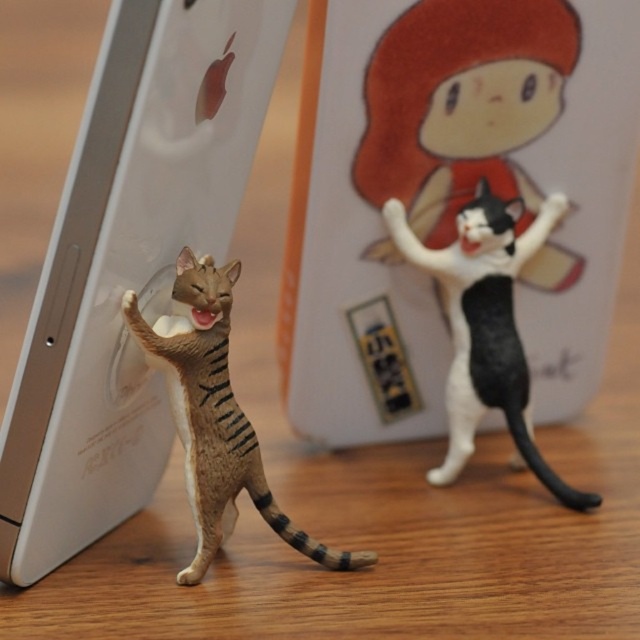
You are setting up a display on a shelf and want to place the matte white phone at left and the black and white plastic cat at right so that both are visible. Since the phone is taller, where should you position the shorter object to ensure it doesn

The black and white plastic cat at right is shorter than the matte white phone at left. To ensure visibility, position the shorter black and white plastic cat at right closer to the front of the shelf so it is not obscured by the taller phone.

You are organizing a display and need to place both the black and white plastic cat at right and the brown striped cat at center on a shelf. The shelf has a maximum length of 15 inches. Can both figurines fit side by side without overlapping?

The distance between the black and white plastic cat at right and the brown striped cat at center is 12.88 inches, which is less than the shelf length of 15 inches. Therefore, both figurines can fit side by side on the shelf without overlapping.